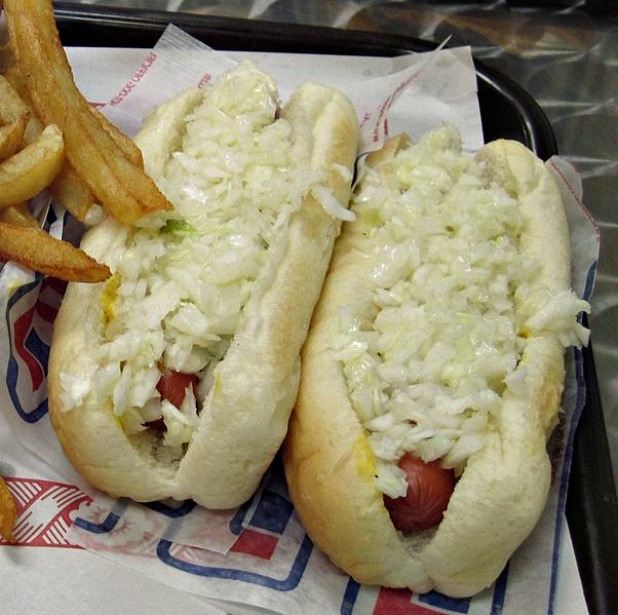
Find the location of a particular element. empty space on table to the right of tray is located at coordinates (604, 336).